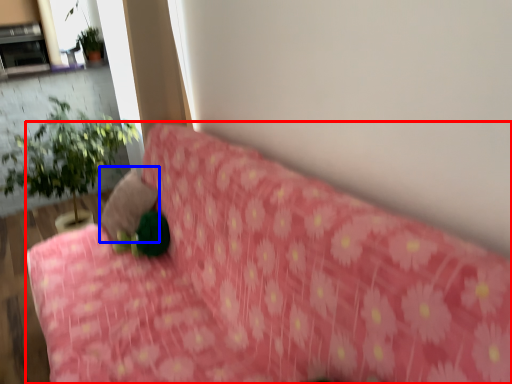
Question: Which object appears farthest to the camera in this image, furniture (highlighted by a red box) or pillow (highlighted by a blue box)?

Choices:
 (A) furniture
 (B) pillow

Answer: (B)